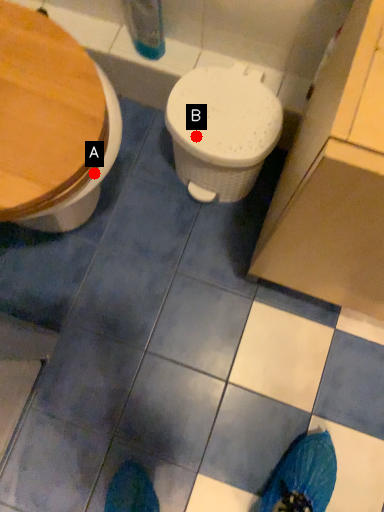
Question: Two points are circled on the image, labeled by A and B beside each circle. Which point is further to the camera?

Choices:
 (A) A is further
 (B) B is further

Answer: (B)